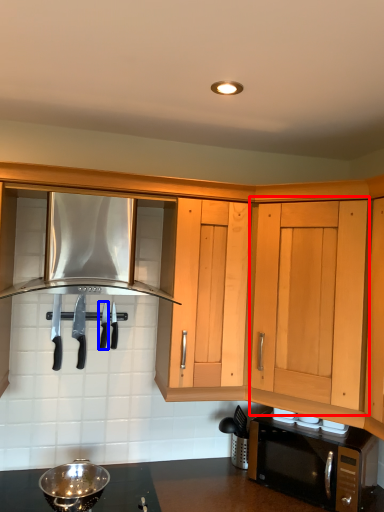
Question: Which point is further to the camera, cabinetry (highlighted by a red box) or silverware (highlighted by a blue box)?

Choices:
 (A) cabinetry
 (B) silverware

Answer: (B)